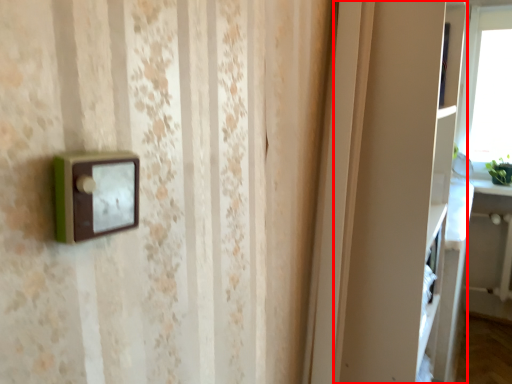
Question: Observing the image, what is the correct spatial positioning of cabinet (annotated by the red box) in reference to table?

Choices:
 (A) right
 (B) left

Answer: (B)